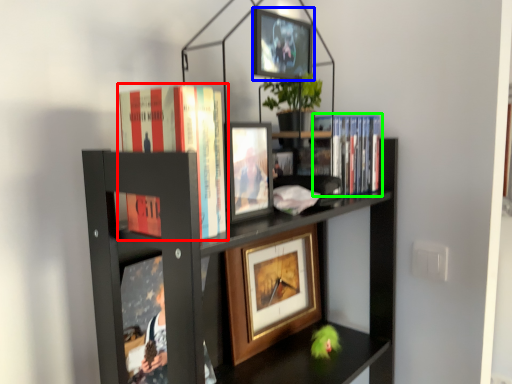
Question: Which object is the farthest from book (highlighted by a red box)? Choose among these: picture frame (highlighted by a blue box) or book (highlighted by a green box).

Choices:
 (A) picture frame
 (B) book

Answer: (B)